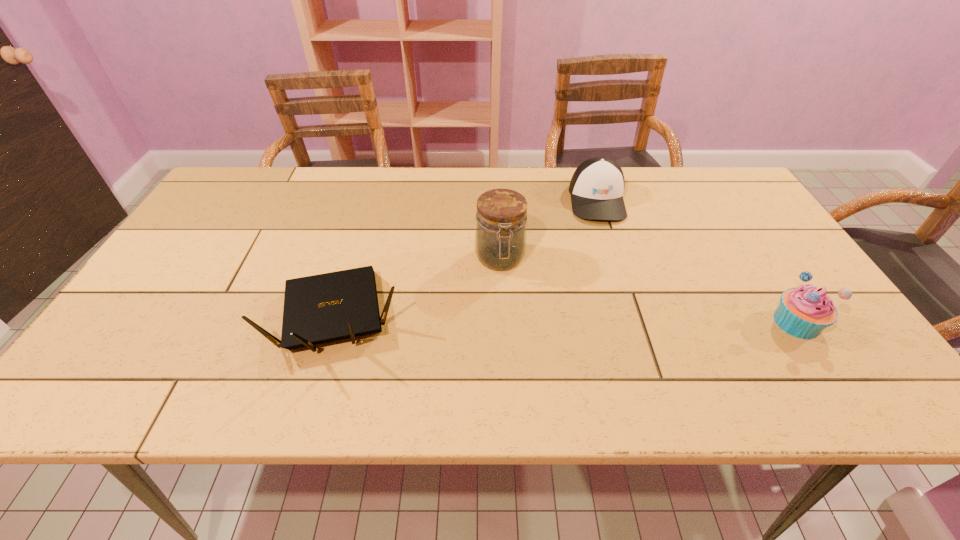
In the image, there is a desktop. Where is `free space at the near edge`? free space at the near edge is located at coordinates (532, 355).

Identify the location of free region at the left edge. pyautogui.click(x=175, y=264).

At what (x,y) coordinates should I click in order to perform the action: click on vacant region at the right edge of the desktop. Please return your answer as a coordinate pair (x, y). The image size is (960, 540). Looking at the image, I should click on (771, 275).

In the image, there is a desktop. Where is `vacant space at the far left corner`? vacant space at the far left corner is located at coordinates (245, 181).

The height and width of the screenshot is (540, 960). Find the location of `unoccupied area between the tallest object and the router`. unoccupied area between the tallest object and the router is located at coordinates (420, 288).

Locate an element on the screen. This screenshot has height=540, width=960. vacant space that's between the router and the third object from right to left is located at coordinates (420, 288).

Locate an element on the screen. The width and height of the screenshot is (960, 540). empty space that is in between the tallest object and the router is located at coordinates (420, 288).

This screenshot has height=540, width=960. Identify the location of free area in between the router and the muffin. [x=568, y=320].

The height and width of the screenshot is (540, 960). What are the coordinates of `vacant space in between the rightmost object and the leftmost object` in the screenshot? It's located at (568, 320).

Find the location of a particular element. vacant area between the jar and the rightmost object is located at coordinates (648, 291).